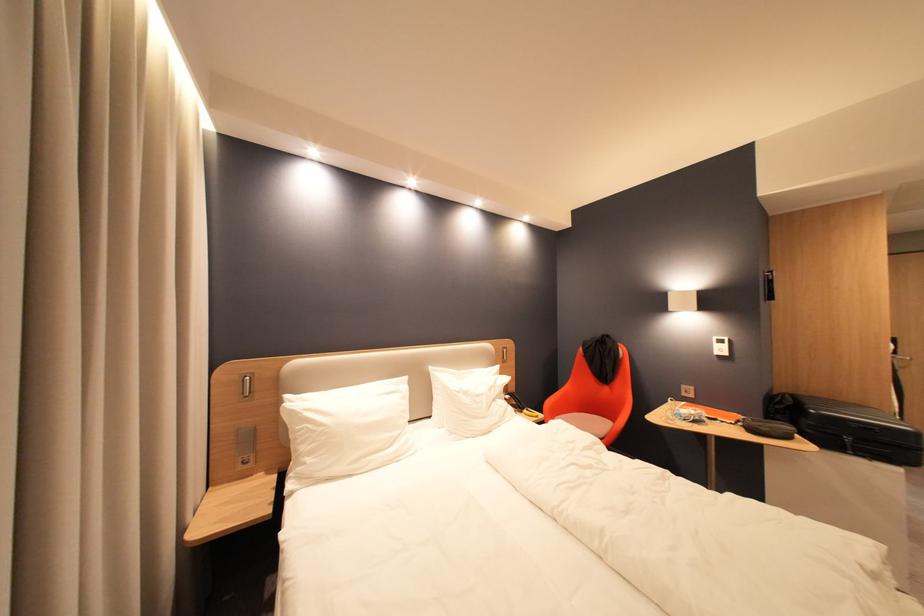
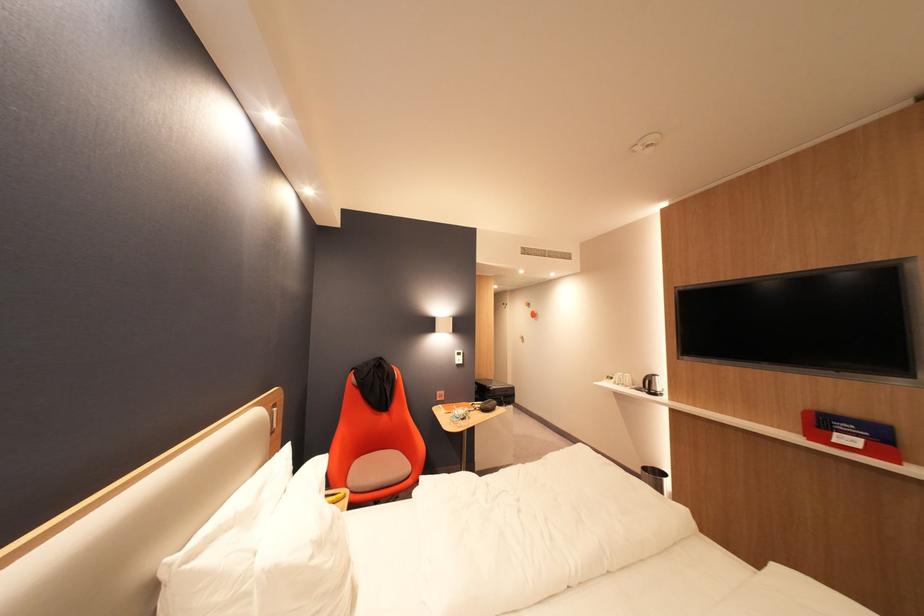
In the second image, find the point that corresponds to point 821,413 in the first image.

(502, 390)